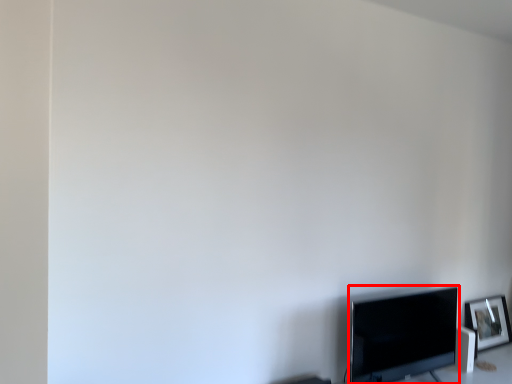
Question: Where is television (annotated by the red box) located in relation to picture frame in the image?

Choices:
 (A) right
 (B) left

Answer: (B)